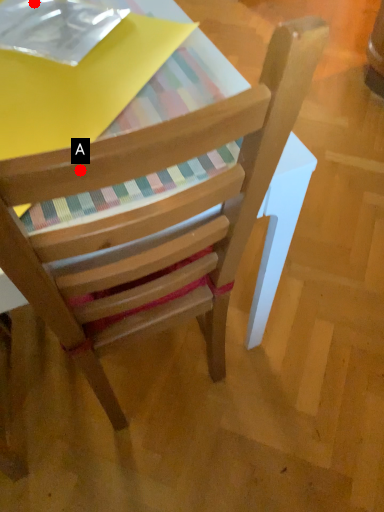
Question: Two points are circled on the image, labeled by A and B beside each circle. Which point is closer to the camera?

Choices:
 (A) A is closer
 (B) B is closer

Answer: (A)